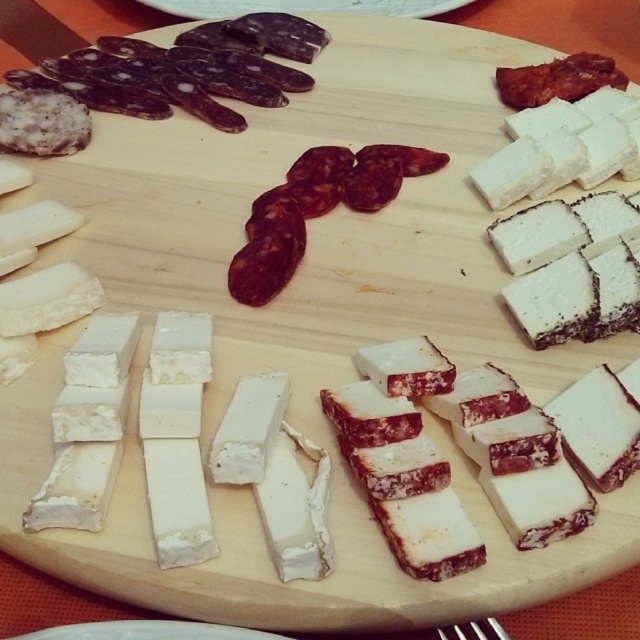
Does dark brown cured meat at upper left appear over white crumbly cheese at center?

Yes.

Which is above, dark brown cured meat at upper left or white crumbly cheese at center?

dark brown cured meat at upper left

You are a GUI agent. You are given a task and a screenshot of the screen. Output one action in this format:
    pyautogui.click(x=<x>, y=<y>)
    Task: Click on the dark brown cured meat at upper left
    The height and width of the screenshot is (640, 640).
    Given the screenshot: What is the action you would take?
    pyautogui.click(x=186, y=68)

The image size is (640, 640). Find the location of `dark brown cured meat at upper left`. dark brown cured meat at upper left is located at coordinates (186, 68).

Is point (298, 483) more distant than point (442, 634)?

That is True.

Does white crumbly cheese at center have a greater width compared to metallic silver fork at lower center?

Yes.

Does point (300, 488) lie in front of point (500, 632)?

No.

This screenshot has width=640, height=640. Identify the location of white crumbly cheese at center. (296, 508).

Does point (310, 168) come farther from viewer compared to point (289, 568)?

Yes, it is.

Describe the element at coordinates (316, 209) in the screenshot. This screenshot has width=640, height=640. I see `dark red cured meat at center` at that location.

Where is `dark red cured meat at center`? This screenshot has width=640, height=640. dark red cured meat at center is located at coordinates (316, 209).